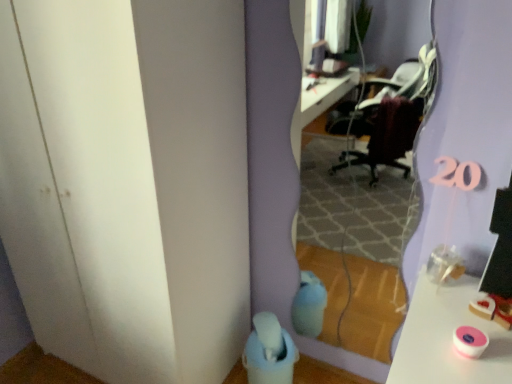
Question: From the image's perspective, relative to clear glass mirror at center, is transparent plastic door at lower left above or below?

Choices:
 (A) below
 (B) above

Answer: (B)

Question: Considering the positions of transparent plastic door at lower left and clear glass mirror at center in the image, is transparent plastic door at lower left wider or thinner than clear glass mirror at center?

Choices:
 (A) wide
 (B) thin

Answer: (A)

Question: Considering the positions of transparent plastic door at lower left and clear glass mirror at center in the image, is transparent plastic door at lower left bigger or smaller than clear glass mirror at center?

Choices:
 (A) big
 (B) small

Answer: (A)

Question: Relative to transparent plastic door at lower left, is clear glass mirror at center in front or behind?

Choices:
 (A) front
 (B) behind

Answer: (B)

Question: From a real-world perspective, is clear glass mirror at center physically located above or below transparent plastic door at lower left?

Choices:
 (A) above
 (B) below

Answer: (A)

Question: Is point (333, 152) closer or farther from the camera than point (106, 62)?

Choices:
 (A) farther
 (B) closer

Answer: (A)

Question: Is clear glass mirror at center to the left or to the right of transparent plastic door at lower left in the image?

Choices:
 (A) right
 (B) left

Answer: (A)